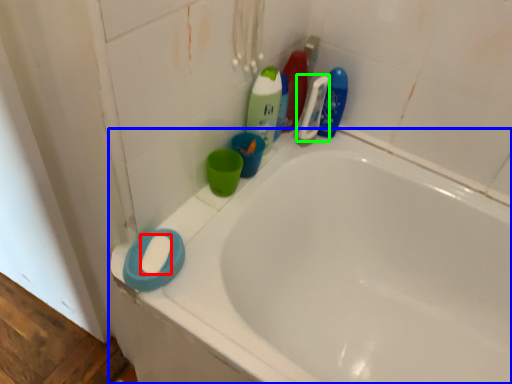
Question: Which is nearer to the soap (highlighted by a red box)? bathtub (highlighted by a blue box) or cleaning product (highlighted by a green box).

Choices:
 (A) bathtub
 (B) cleaning product

Answer: (A)